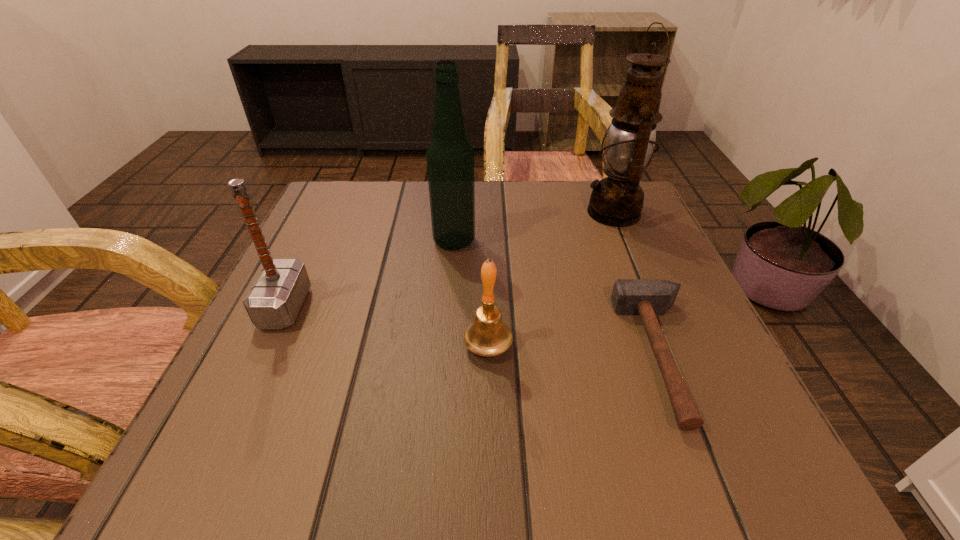
In order to click on object at the far right corner in this screenshot , I will do `click(617, 200)`.

This screenshot has width=960, height=540. In order to click on object that is at the near right corner in this screenshot , I will do `click(646, 297)`.

In the image, there is a desktop. At what (x,y) coordinates should I click in order to perform the action: click on vacant space at the far edge. Please return your answer as a coordinate pair (x, y). The width and height of the screenshot is (960, 540). Looking at the image, I should click on (486, 192).

Identify the location of free spot at the near edge of the desktop. This screenshot has height=540, width=960. (623, 459).

Find the location of a particular element. The width and height of the screenshot is (960, 540). free region at the left edge is located at coordinates (351, 249).

This screenshot has height=540, width=960. In the image, there is a desktop. Find the location of `vacant space at the right edge`. vacant space at the right edge is located at coordinates (671, 279).

Where is `vacant space at the far left corner of the desktop`? This screenshot has height=540, width=960. vacant space at the far left corner of the desktop is located at coordinates (339, 221).

This screenshot has width=960, height=540. Identify the location of vacant area at the near right corner of the desktop. (664, 456).

You are a GUI agent. You are given a task and a screenshot of the screen. Output one action in this format:
    pyautogui.click(x=<x>, y=<y>)
    Task: Click on the vacant area that lies between the bell and the alcohol
    Image resolution: width=960 pixels, height=540 pixels.
    Given the screenshot: What is the action you would take?
    pyautogui.click(x=471, y=293)

At what (x,y) coordinates should I click in order to perform the action: click on vacant area that lies between the alcohol and the oil lamp. Please return your answer as a coordinate pair (x, y). The image size is (960, 540). Looking at the image, I should click on (534, 227).